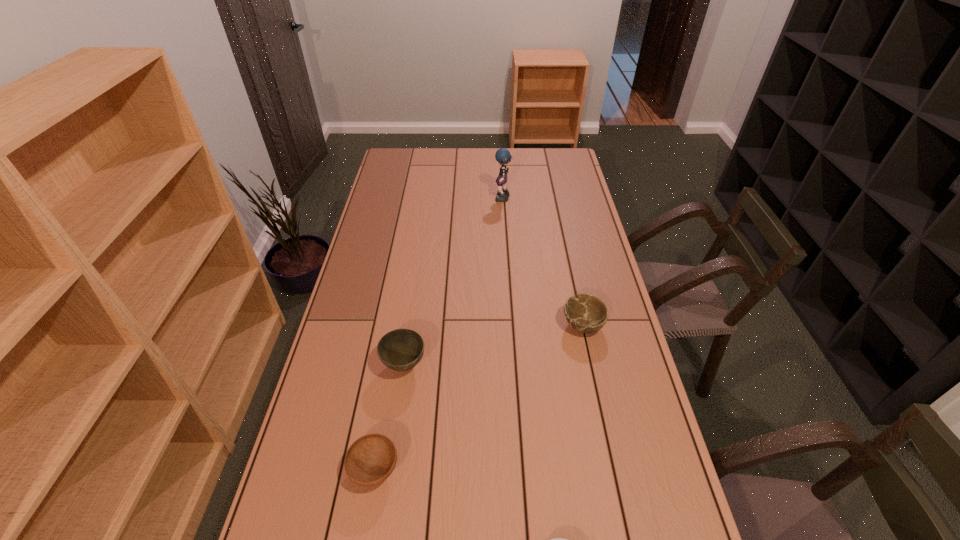
This screenshot has width=960, height=540. In order to click on rag doll in this screenshot , I will do `click(502, 155)`.

In order to click on the tallest object in this screenshot , I will do `click(502, 155)`.

Locate an element on the screen. The height and width of the screenshot is (540, 960). the second tallest object is located at coordinates (402, 349).

You are a GUI agent. You are given a task and a screenshot of the screen. Output one action in this format:
    pyautogui.click(x=<x>, y=<y>)
    Task: Click on the second farthest bowl
    
    Given the screenshot: What is the action you would take?
    pyautogui.click(x=402, y=349)

Find the location of a particular element. The image size is (960, 540). the farthest bowl is located at coordinates (587, 314).

Locate an element on the screen. This screenshot has height=540, width=960. the rightmost object is located at coordinates (587, 314).

Where is `the fourth farthest object`? This screenshot has width=960, height=540. the fourth farthest object is located at coordinates (370, 460).

The height and width of the screenshot is (540, 960). Find the location of `the shortest bowl`. the shortest bowl is located at coordinates (370, 460).

I want to click on vacant space located on the front-facing side of the rag doll, so click(x=423, y=199).

At what (x,y) coordinates should I click in order to perform the action: click on free space located on the front-facing side of the rag doll. Please return your answer as a coordinate pair (x, y). The height and width of the screenshot is (540, 960). Looking at the image, I should click on (435, 199).